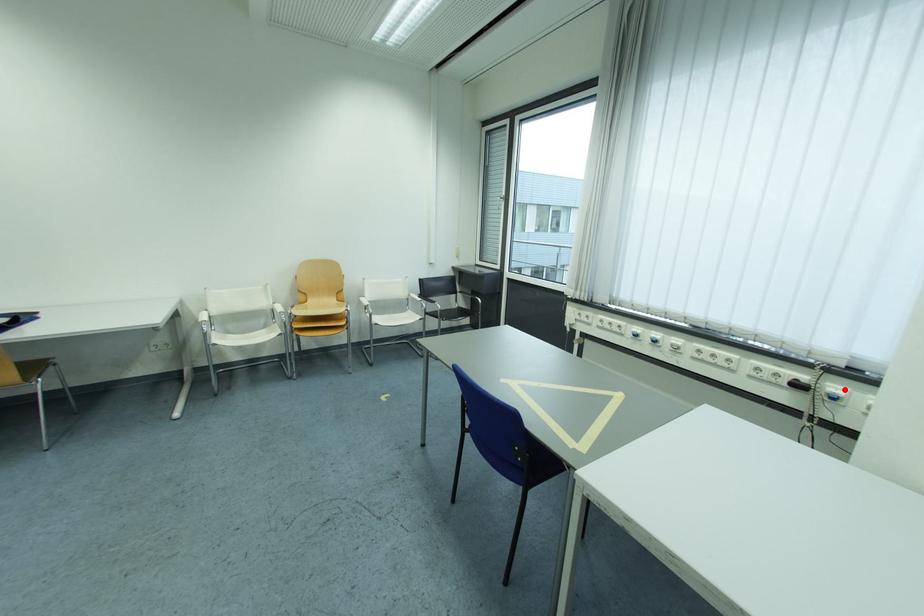
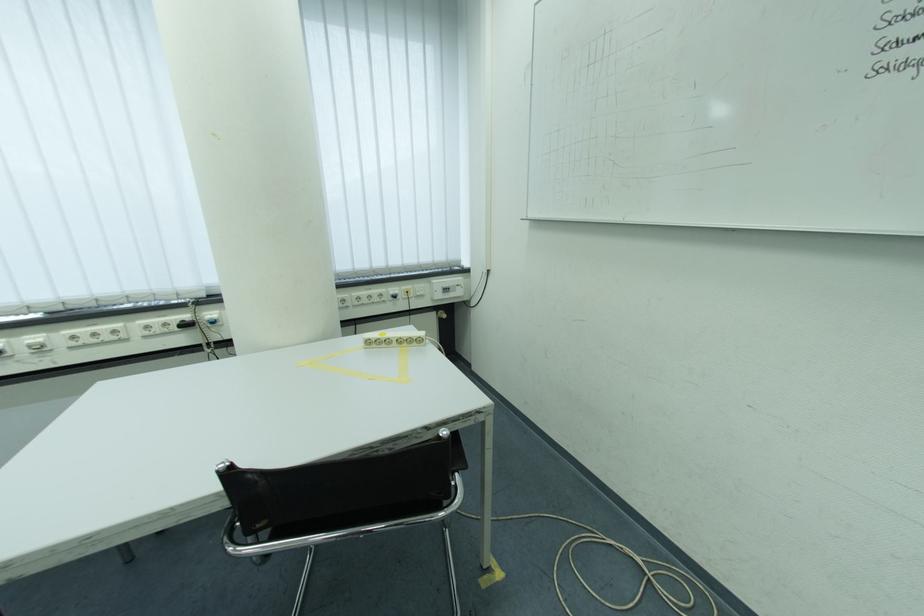
Where in the second image is the point corresponding to the highlighted location from the first image?

(217, 315)